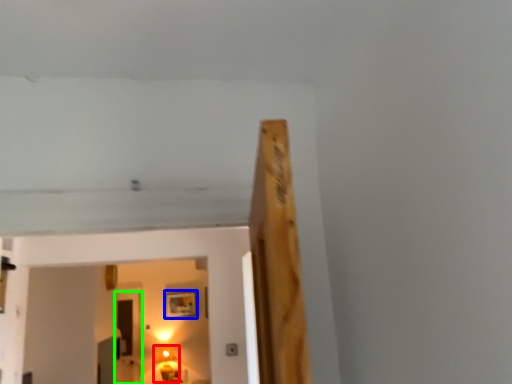
Question: Considering the real-world distances, which object is closest to lamp (highlighted by a red box)? picture frame (highlighted by a blue box) or glass door (highlighted by a green box).

Choices:
 (A) picture frame
 (B) glass door

Answer: (B)